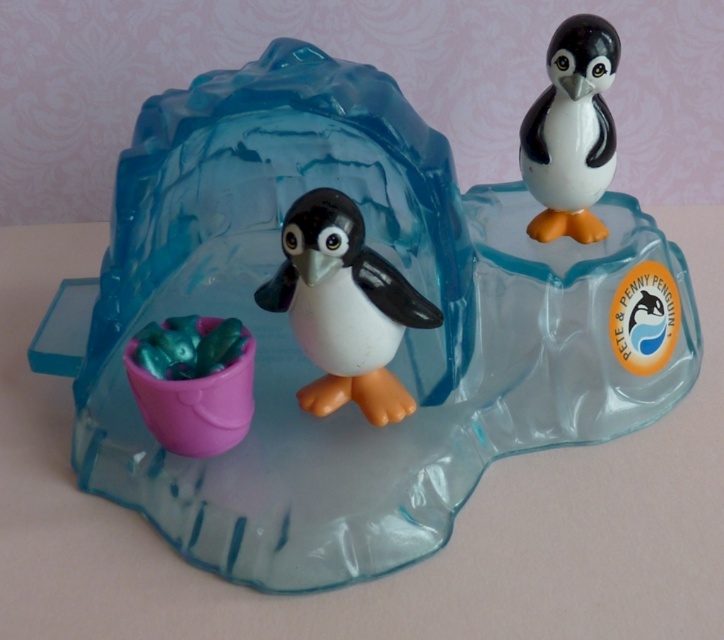
Looking at this image, between white glossy penguin at center and smooth glossy penguin at upper right, which one appears on the right side from the viewer's perspective?

smooth glossy penguin at upper right

Does white glossy penguin at center appear under smooth glossy penguin at upper right?

Correct, white glossy penguin at center is located below smooth glossy penguin at upper right.

Is point (358, 288) more distant than point (606, 108)?

That is False.

Find the location of a particular element. The height and width of the screenshot is (640, 724). white glossy penguin at center is located at coordinates (345, 307).